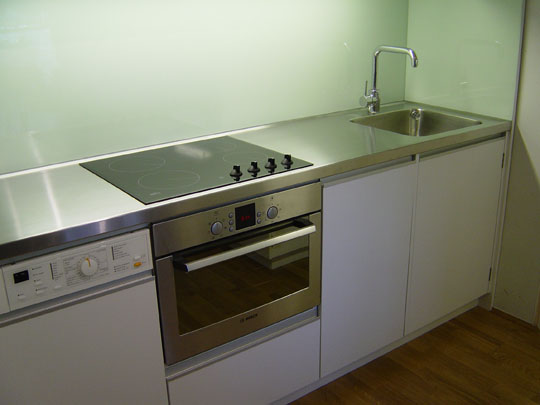
Where is `glass of the oven door`? Image resolution: width=540 pixels, height=405 pixels. glass of the oven door is located at coordinates (240, 288).